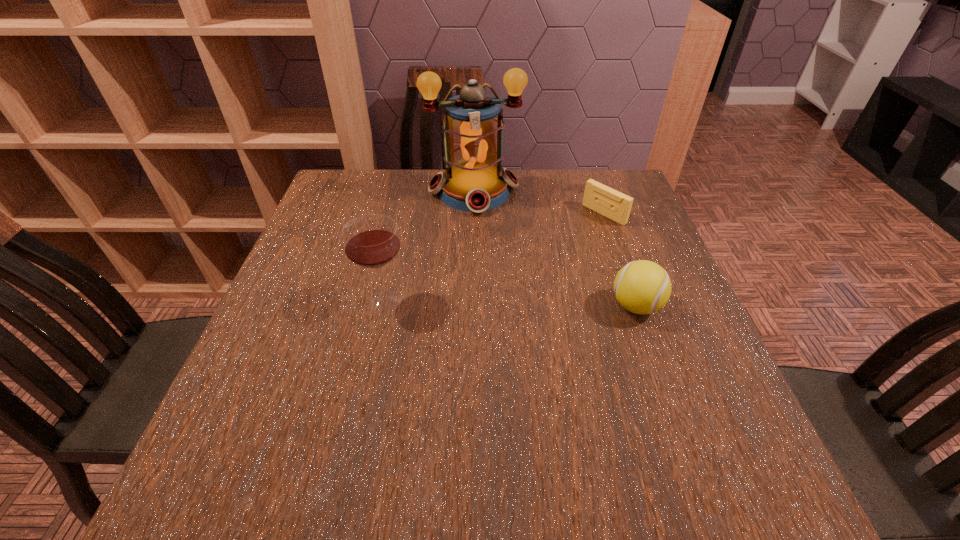
Find the location of a particular element. wineglass is located at coordinates (371, 241).

At what (x,y) coordinates should I click in order to perform the action: click on the second tallest object. Please return your answer as a coordinate pair (x, y). Looking at the image, I should click on (371, 241).

You are a GUI agent. You are given a task and a screenshot of the screen. Output one action in this format:
    pyautogui.click(x=<x>, y=<y>)
    Task: Click on the third tallest object
    This screenshot has width=960, height=540.
    Given the screenshot: What is the action you would take?
    pyautogui.click(x=642, y=287)

The width and height of the screenshot is (960, 540). Find the location of `videotape`. videotape is located at coordinates (600, 198).

This screenshot has width=960, height=540. Find the location of `the tallest object`. the tallest object is located at coordinates (474, 180).

Where is `the second object from left to right`? The image size is (960, 540). the second object from left to right is located at coordinates (474, 180).

You are a GUI agent. You are given a task and a screenshot of the screen. Output one action in this format:
    pyautogui.click(x=<x>, y=<y>)
    Task: Click on the vacant region located 0.070m on the left of the wineglass
    
    Given the screenshot: What is the action you would take?
    pyautogui.click(x=326, y=300)

The width and height of the screenshot is (960, 540). Identify the location of free spot located on the left of the tennis ball. (521, 306).

Find the location of `vacant space located 0.400m at the front of the shortest object with spools`. vacant space located 0.400m at the front of the shortest object with spools is located at coordinates (484, 296).

Locate an element on the screen. Image resolution: width=960 pixels, height=540 pixels. free point located at the front of the shortest object with spools is located at coordinates [554, 248].